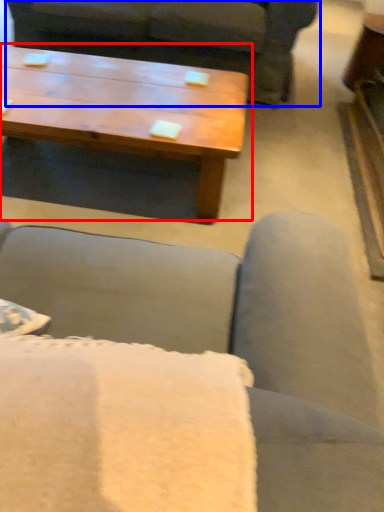
Question: Which of the following is the farthest to the observer, coffee table (highlighted by a red box) or studio couch (highlighted by a blue box)?

Choices:
 (A) coffee table
 (B) studio couch

Answer: (B)